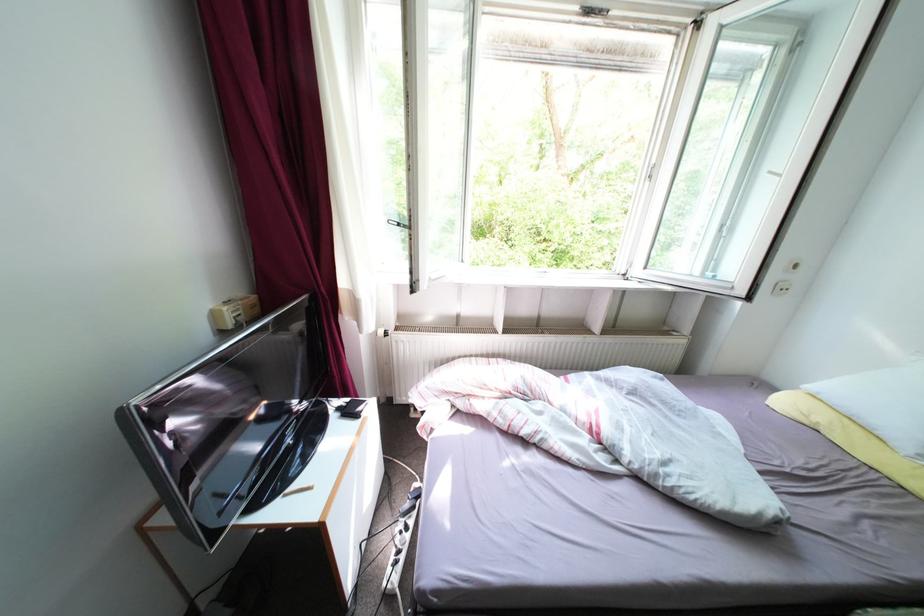
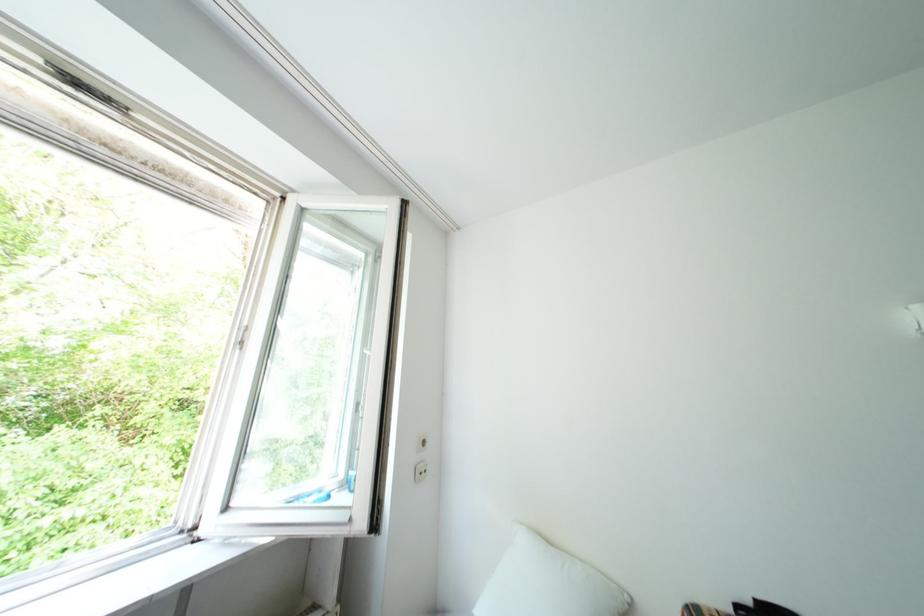
The images are taken continuously from a first-person perspective. In which direction is your viewpoint rotating?

The rotation direction of the camera is right-up.